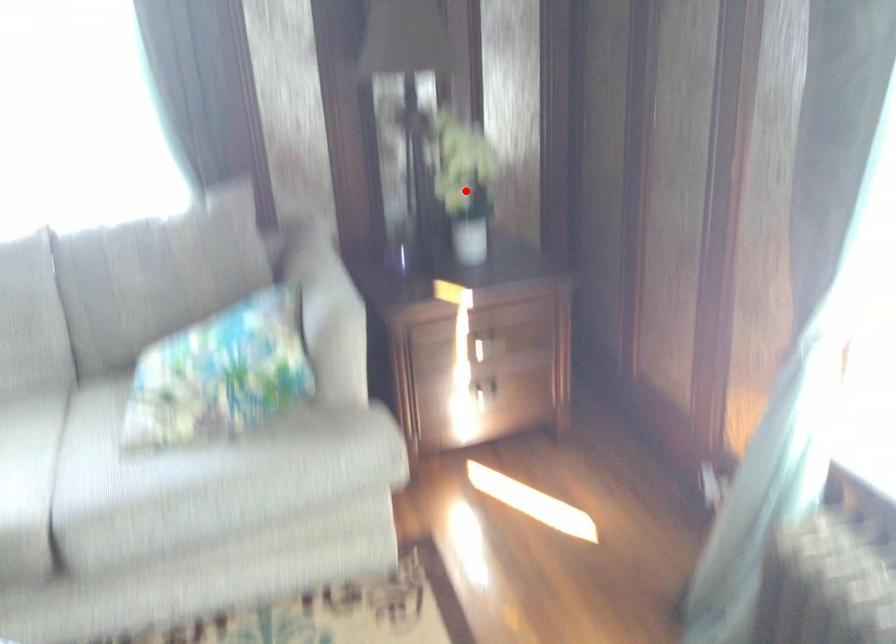
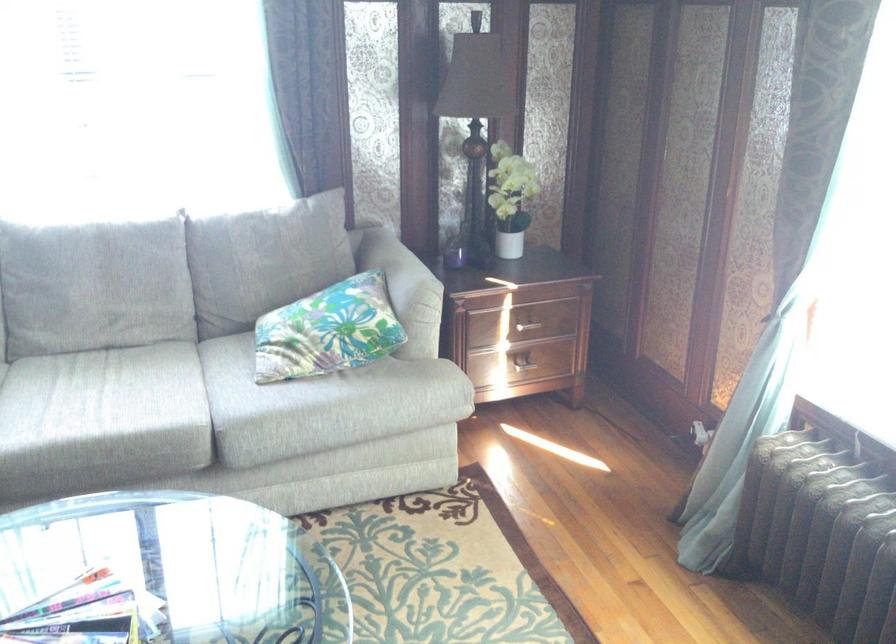
Question: I am providing you with two images of the same scene from different viewpoints. A red point is shown in image1. For the corresponding object point in image2, is it positioned nearer or farther from the camera?

Choices:
 (A) Nearer
 (B) Farther

Answer: (B)